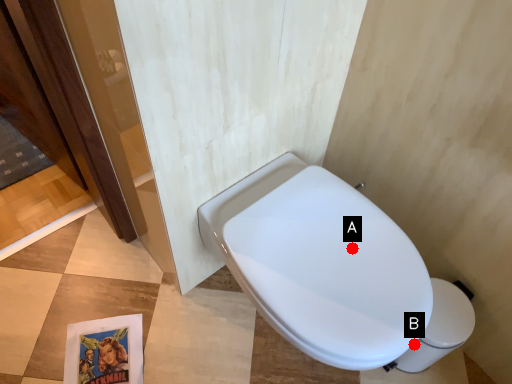
Question: Two points are circled on the image, labeled by A and B beside each circle. Which point is closer to the camera taking this photo?

Choices:
 (A) A is closer
 (B) B is closer

Answer: (A)